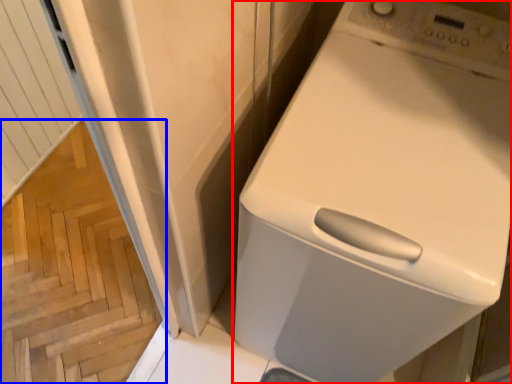
Question: Which object is further to the camera taking this photo, home appliance (highlighted by a red box) or stairwell (highlighted by a blue box)?

Choices:
 (A) home appliance
 (B) stairwell

Answer: (B)